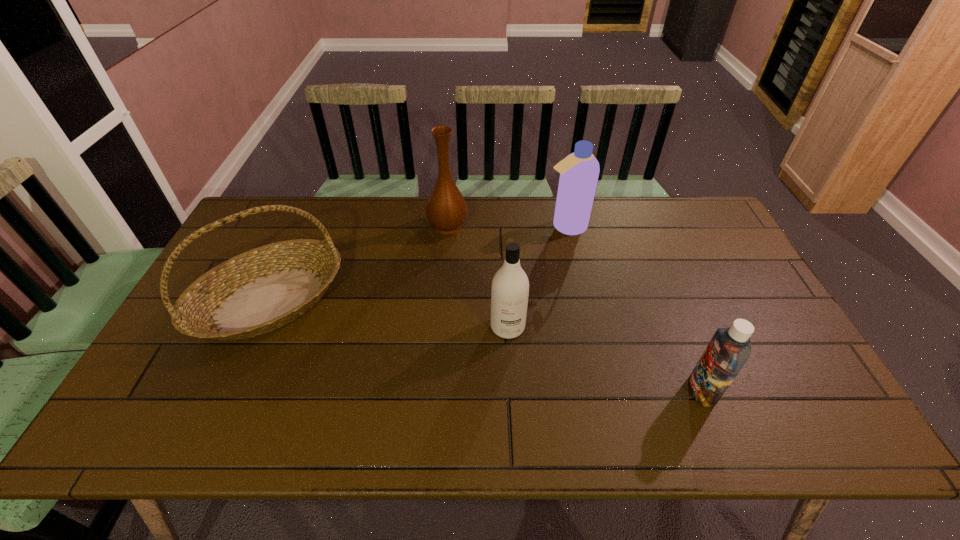
Image resolution: width=960 pixels, height=540 pixels. In order to click on vase in this screenshot , I will do `click(446, 210)`.

Identify the location of the farthest shampoo. The width and height of the screenshot is (960, 540). (579, 171).

The image size is (960, 540). What are the coordinates of `the second shampoo from right to left` in the screenshot? It's located at 579,171.

The height and width of the screenshot is (540, 960). I want to click on the leftmost object, so click(x=258, y=291).

Where is `the leftmost shampoo`? the leftmost shampoo is located at coordinates (510, 287).

This screenshot has height=540, width=960. I want to click on the third object from left to right, so [x=510, y=287].

The height and width of the screenshot is (540, 960). I want to click on the rightmost object, so (729, 349).

The image size is (960, 540). In order to click on the shortest object in this screenshot , I will do `click(729, 349)`.

The width and height of the screenshot is (960, 540). Find the location of `free space located 0.110m on the right of the fourth object from right to left`. free space located 0.110m on the right of the fourth object from right to left is located at coordinates (500, 226).

Locate an element on the screen. The width and height of the screenshot is (960, 540). vacant space located on the front of the second shampoo from right to left is located at coordinates (577, 276).